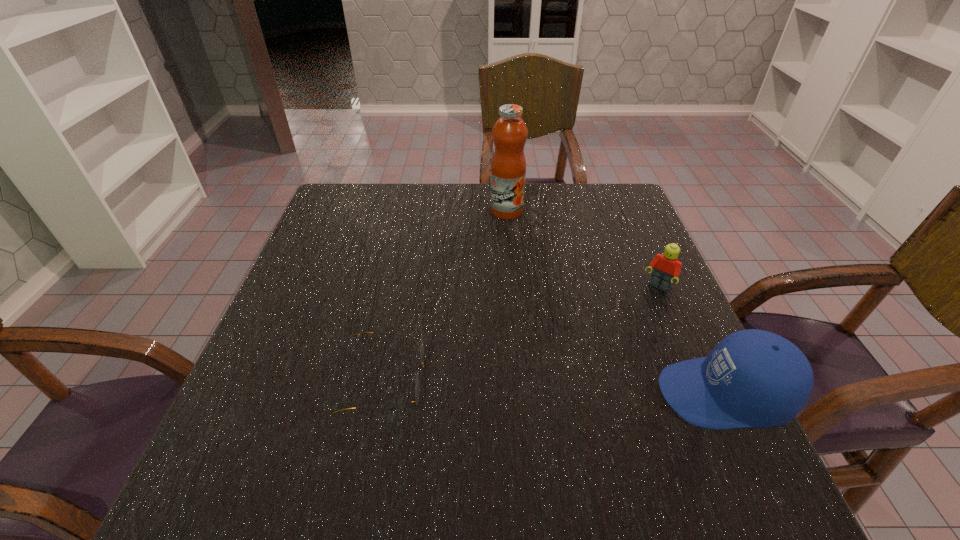
The width and height of the screenshot is (960, 540). I want to click on free space between the fruit juice and the cap, so click(615, 302).

I want to click on free space between the shortest object and the fruit juice, so click(x=445, y=295).

Locate an element on the screen. empty location between the spectacles and the second farthest object is located at coordinates (521, 334).

At what (x,y) coordinates should I click in order to perform the action: click on free space between the second farthest object and the leftmost object. Please return your answer as a coordinate pair (x, y). Looking at the image, I should click on (521, 334).

Locate an element on the screen. The image size is (960, 540). unoccupied area between the cap and the shortest object is located at coordinates (554, 387).

What are the coordinates of `free space between the Lego and the cap` in the screenshot? It's located at coord(690,341).

Image resolution: width=960 pixels, height=540 pixels. In order to click on vacant space that's between the cap and the spectacles in this screenshot , I will do `click(554, 387)`.

Where is `vacant space in between the Lego and the cap`? vacant space in between the Lego and the cap is located at coordinates (690, 341).

This screenshot has width=960, height=540. In order to click on free spot between the tallest object and the second farthest object in this screenshot , I will do `click(582, 249)`.

Identify the location of object that stands as the closest to the shortest object. The height and width of the screenshot is (540, 960). (753, 378).